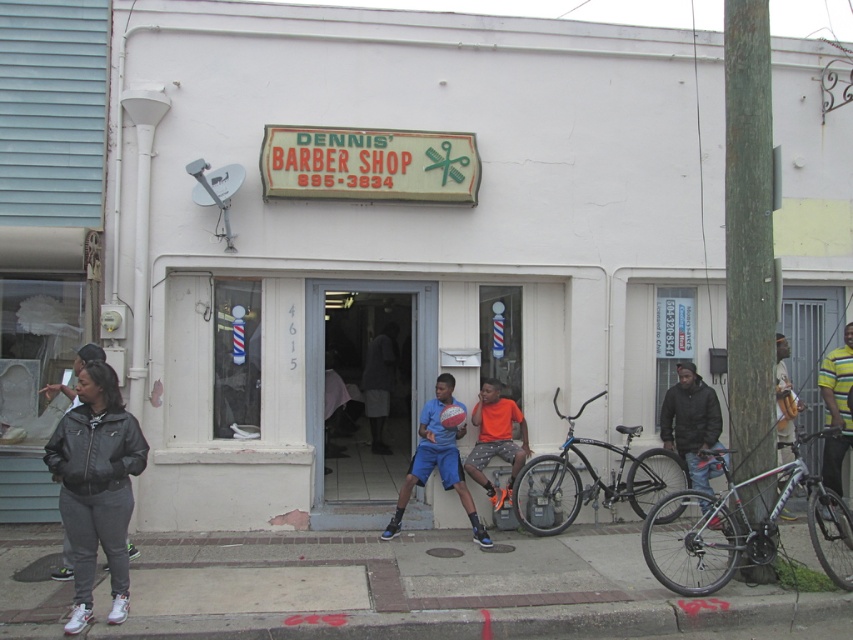
Question: Which of these objects is positioned closest to the dark gray fabric shirt at center?

Choices:
 (A) blue athletic shorts at center
 (B) camouflage fabric shirt at right
 (C) black matte bicycle at right
 (D) leather jacket at lower left

Answer: (A)

Question: Where is concrete sidewalk at lower center located in relation to silver metallic bicycle at lower right in the image?

Choices:
 (A) left
 (B) right

Answer: (A)

Question: Which object is farther from the camera taking this photo?

Choices:
 (A) silver metallic bicycle at lower right
 (B) black matte bicycle at right
 (C) dark brown leather jacket at right

Answer: (C)

Question: Does dark brown leather jacket at right appear on the left side of yellow striped shirt at upper right?

Choices:
 (A) yes
 (B) no

Answer: (A)

Question: Can you confirm if white matte storefront at center is positioned to the right of silver metallic bicycle at lower right?

Choices:
 (A) no
 (B) yes

Answer: (A)

Question: Which object appears closest to the camera in this image?

Choices:
 (A) blue athletic shorts at center
 (B) leather jacket at lower left
 (C) yellow striped shirt at upper right
 (D) concrete sidewalk at lower center

Answer: (B)